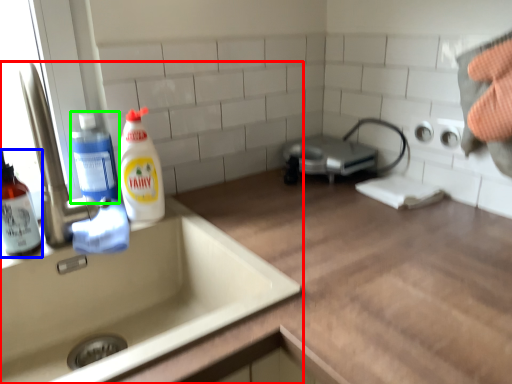
Question: Considering the real-world distances, which object is closest to sink (highlighted by a red box)? cleaning product (highlighted by a blue box) or cleaning product (highlighted by a green box).

Choices:
 (A) cleaning product
 (B) cleaning product

Answer: (A)